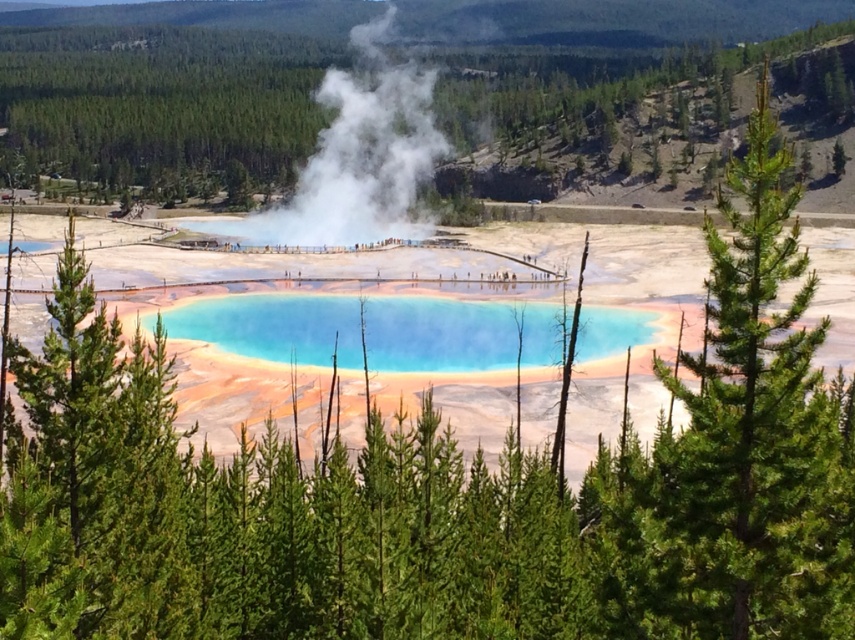
You are a park ranger observing the geothermal area. You notice the green leafy tree at upper center and the white vapor at center. Which object is located above the other?

The green leafy tree at upper center is positioned over the white vapor at center, meaning it is above it.

Based on the scene description, where is the green leafy tree at upper center located in terms of its 2D coordinates?

The green leafy tree at upper center is located at the 2D coordinates of point (600, 93).

You are a hiker who wants to take a photo of the translucent blue water at center. However, you notice the green leafy tree at upper center might block your view. Based on their sizes, which object is larger and could potentially obstruct the view of the other?

The green leafy tree at upper center is bigger than the translucent blue water at center, so it could potentially obstruct the view of the translucent blue water at center.